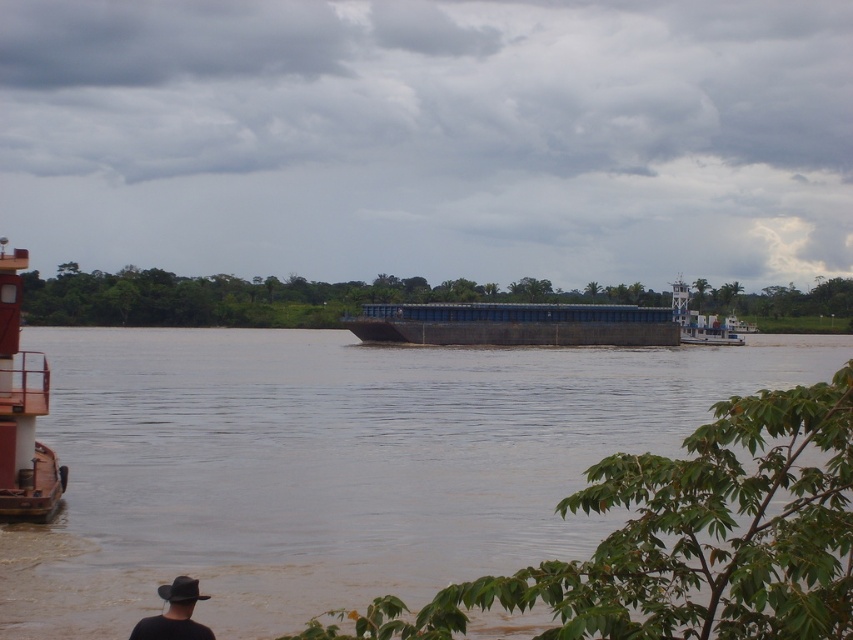
Is brown matte river at center shorter than dark blue matte barge at center?

No, brown matte river at center is not shorter than dark blue matte barge at center.

Is brown matte river at center to the left of dark blue matte barge at center from the viewer's perspective?

Yes, brown matte river at center is to the left of dark blue matte barge at center.

Is point (393, 412) farther from camera compared to point (521, 339)?

No, it is in front of (521, 339).

Where is `brown matte river at center`? brown matte river at center is located at coordinates (335, 465).

Is the position of brown matte river at center less distant than that of rustic wood barge at left?

Yes, brown matte river at center is closer to the viewer.

Measure the distance between brown matte river at center and rustic wood barge at left.

They are 195.55 feet apart.

Does point (137, 449) come closer to viewer compared to point (3, 348)?

No.

Identify the location of brown matte river at center. (335, 465).

Can you confirm if dark blue matte barge at center is shorter than black leather hat at lower left?

Incorrect, dark blue matte barge at center's height does not fall short of black leather hat at lower left's.

Which is behind, point (566, 346) or point (184, 593)?

The point (566, 346) is more distant.

At what (x,y) coordinates should I click in order to perform the action: click on dark blue matte barge at center. Please return your answer as a coordinate pair (x, y). Looking at the image, I should click on (514, 324).